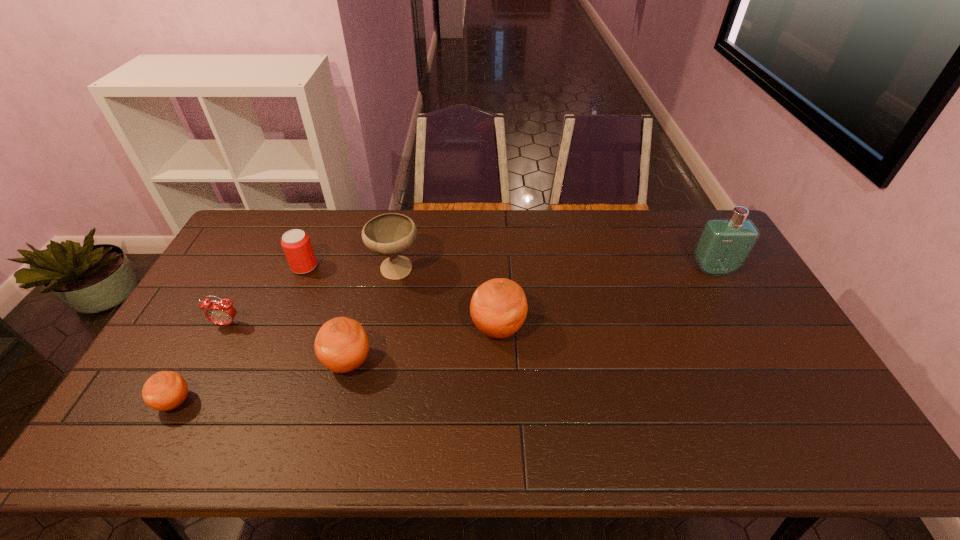
This screenshot has width=960, height=540. What are the coordinates of `vacant point that satisfies the following two spatial constraints: 1. on the back side of the second shortest orange; 2. on the right side of the chalice` in the screenshot? It's located at (372, 271).